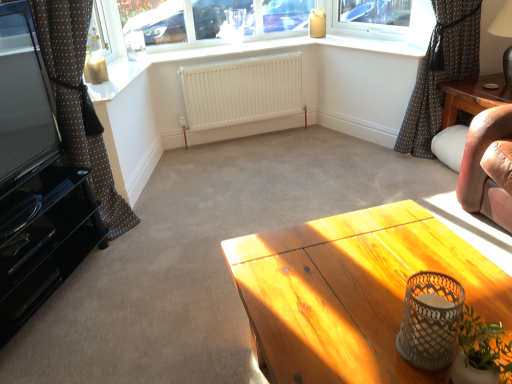
The width and height of the screenshot is (512, 384). Identify the location of unoccupied region to the right of brown polka dot fabric at left, the first curtain positioned from the left. (197, 214).